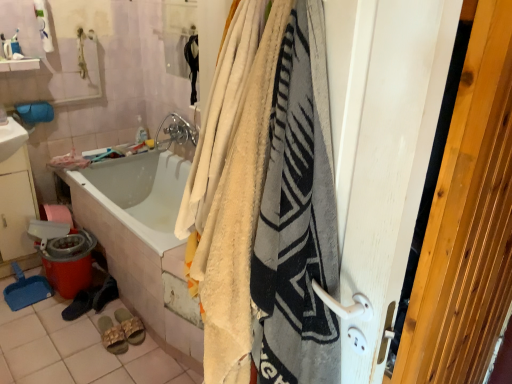
What are the coordinates of `free space in front of black fabric shoe at lower left, positioned as the fourth footwear in right-to-left order` in the screenshot? It's located at (69, 329).